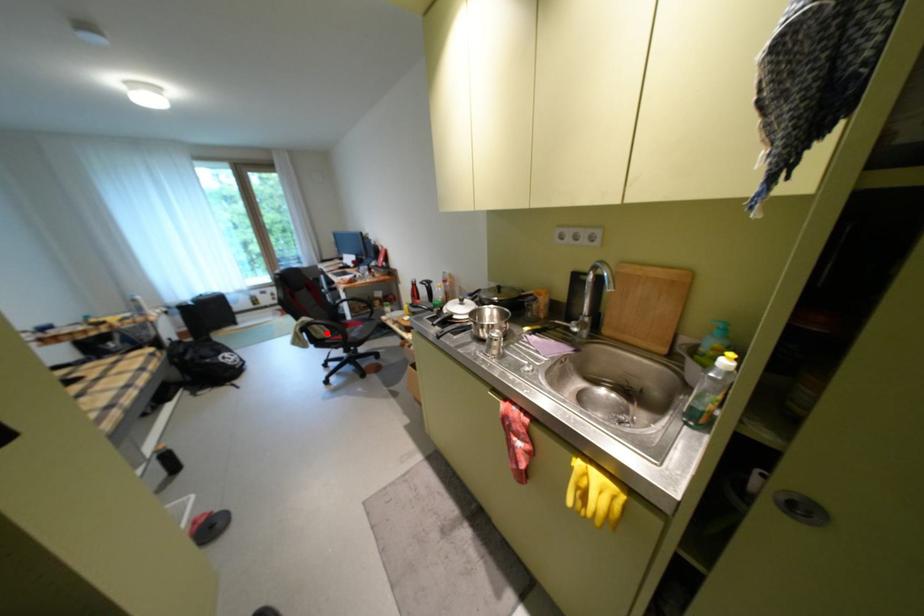
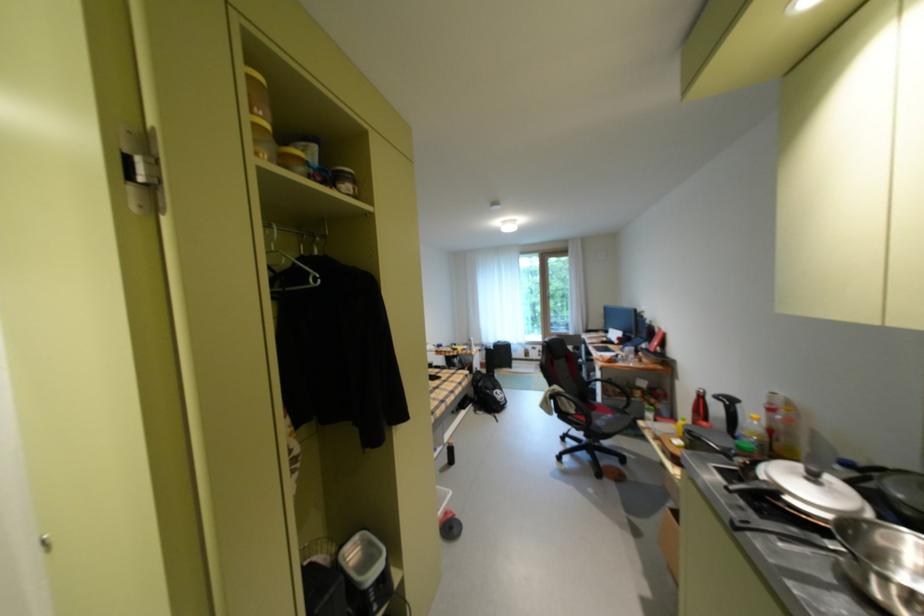
Question: I am providing you with two images of the same scene from different viewpoints. Image1 has a red point marked. In image2, the corresponding 3D location appears at what relative position? Reply with the corresponding letter.

Choices:
 (A) Closer
 (B) Farther

Answer: (B)